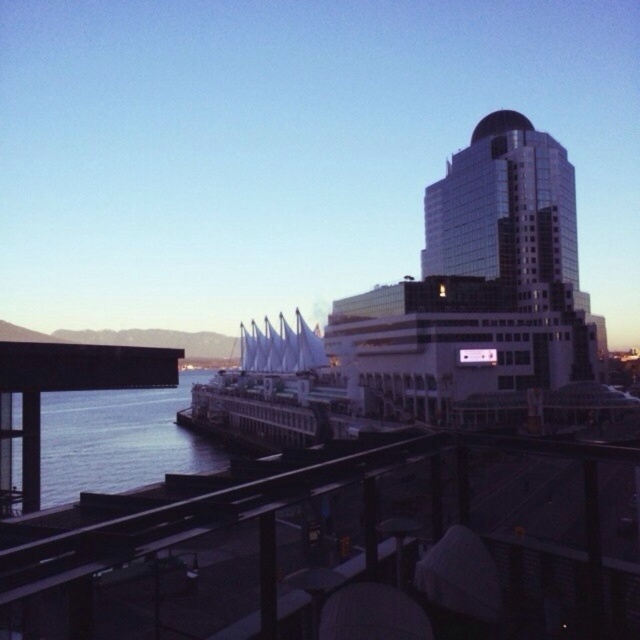
Question: Can you confirm if glossy glass building at upper right is thinner than metallic rail at lower center?

Choices:
 (A) no
 (B) yes

Answer: (A)

Question: Does glossy glass building at upper right come behind metallic rail at lower center?

Choices:
 (A) yes
 (B) no

Answer: (A)

Question: Observing the image, what is the correct spatial positioning of glossy glass building at upper right in reference to metallic rail at lower center?

Choices:
 (A) below
 (B) above

Answer: (B)

Question: Estimate the real-world distances between objects in this image. Which object is closer to the glassy white cruise ship at upper right?

Choices:
 (A) metallic rail at lower center
 (B) glossy glass building at upper right

Answer: (A)

Question: Based on their relative distances, which object is farther from the glossy glass building at upper right?

Choices:
 (A) metallic rail at lower center
 (B) glassy white cruise ship at upper right

Answer: (A)

Question: Considering the real-world distances, which object is farthest from the glassy white cruise ship at upper right?

Choices:
 (A) metallic rail at lower center
 (B) glossy glass building at upper right

Answer: (B)